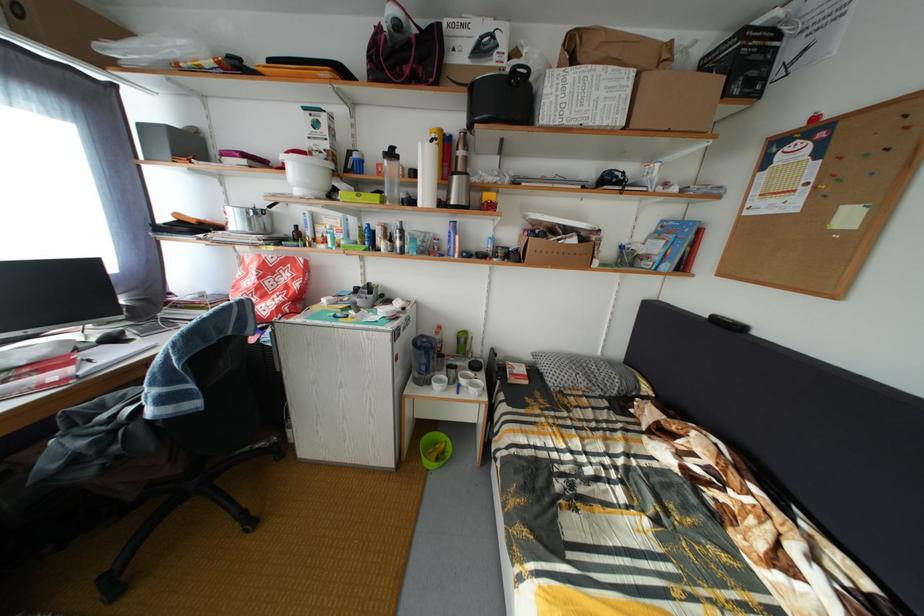
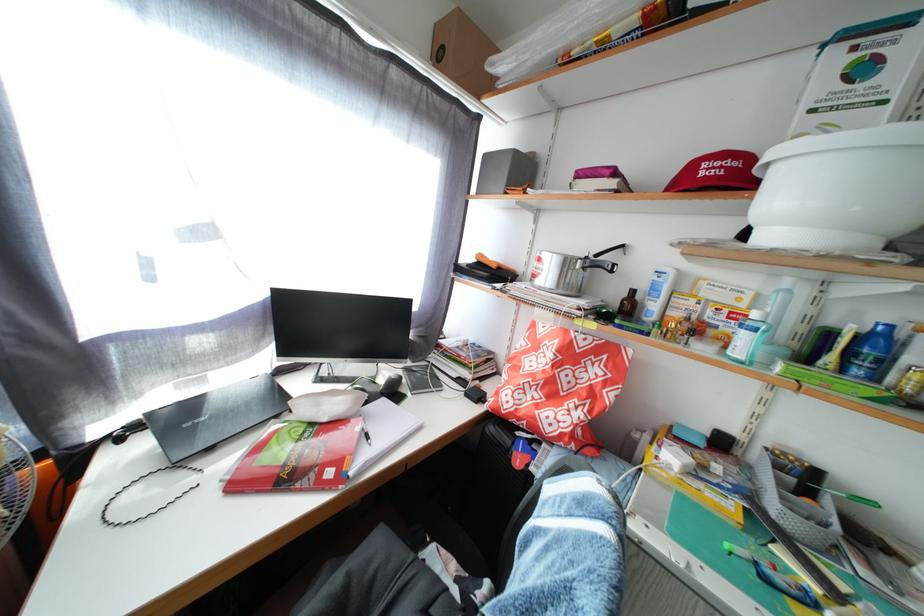
The point at (149, 132) is marked in the first image. Where is the corresponding point in the second image?

(494, 163)